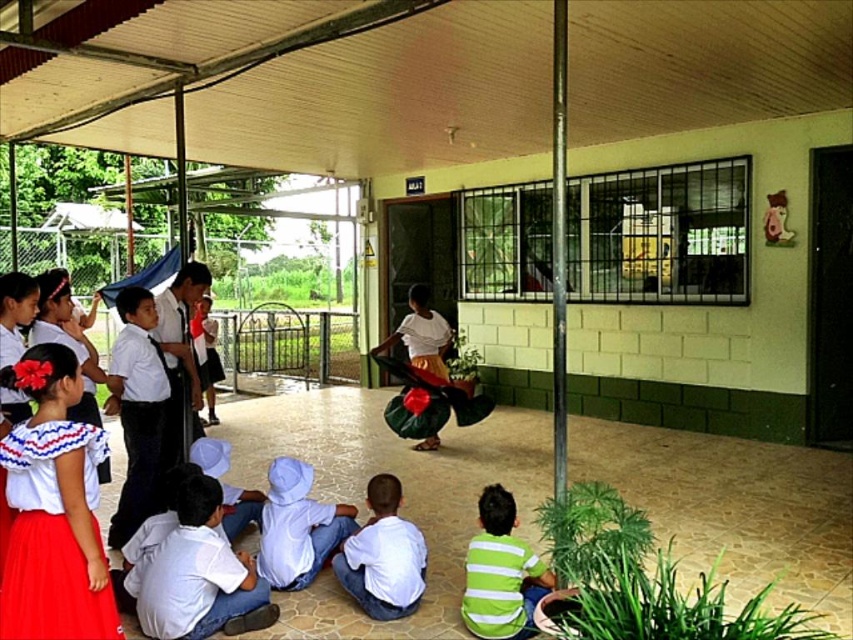
Question: Which object is the farthest from the wooden ceiling at upper center?

Choices:
 (A) white matte shirt at lower center
 (B) green striped shirt at lower right
 (C) matte white blouse at lower left
 (D) white cotton shirt at lower left

Answer: (C)

Question: Is matte white blouse at lower left bigger than green striped shirt at lower right?

Choices:
 (A) no
 (B) yes

Answer: (B)

Question: Which object appears farthest from the camera in this image?

Choices:
 (A) matte white blouse at lower left
 (B) white cotton shirt at lower left

Answer: (B)

Question: Is white matte shirt at lower center thinner than white cotton shirt at lower center?

Choices:
 (A) yes
 (B) no

Answer: (A)

Question: Can you confirm if wooden ceiling at upper center is wider than white cotton shirt at lower center?

Choices:
 (A) yes
 (B) no

Answer: (A)

Question: Considering the real-world distances, which object is farthest from the white cotton shirt at center?

Choices:
 (A) green striped shirt at lower right
 (B) white matte shirt at lower center
 (C) matte white blouse at lower left
 (D) white cotton shirt at lower left

Answer: (A)